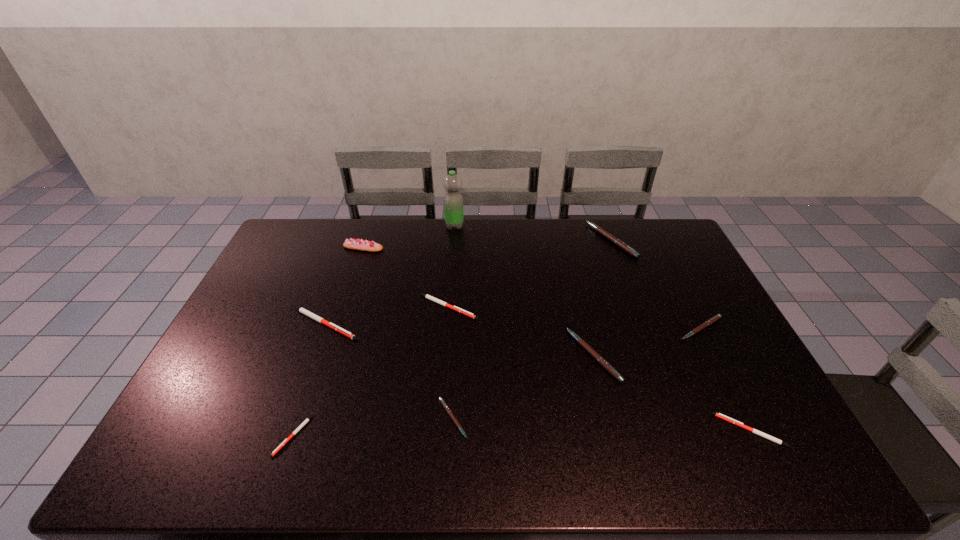
In order to click on water bottle in this screenshot , I will do `click(453, 201)`.

Image resolution: width=960 pixels, height=540 pixels. Identify the location of green water bottle. (453, 201).

At what (x,y) coordinates should I click in order to perform the action: click on the ninth shortest object. Please return your answer as a coordinate pair (x, y). The image size is (960, 540). Looking at the image, I should click on (357, 244).

Locate an element on the screen. This screenshot has width=960, height=540. the sixth pen from left to right is located at coordinates (619, 243).

Find the location of a particular element. the tallest pen is located at coordinates (619, 243).

This screenshot has width=960, height=540. I want to click on the fourth pen from right to left, so click(580, 341).

Where is `the second pink pen from left to right`? This screenshot has height=540, width=960. the second pink pen from left to right is located at coordinates (580, 341).

The image size is (960, 540). What are the coordinates of `the biggest white pen` in the screenshot? It's located at (302, 310).

Find the location of a particular element. The height and width of the screenshot is (540, 960). the third biggest pink pen is located at coordinates (717, 317).

I want to click on the third white pen from left to right, so click(x=427, y=296).